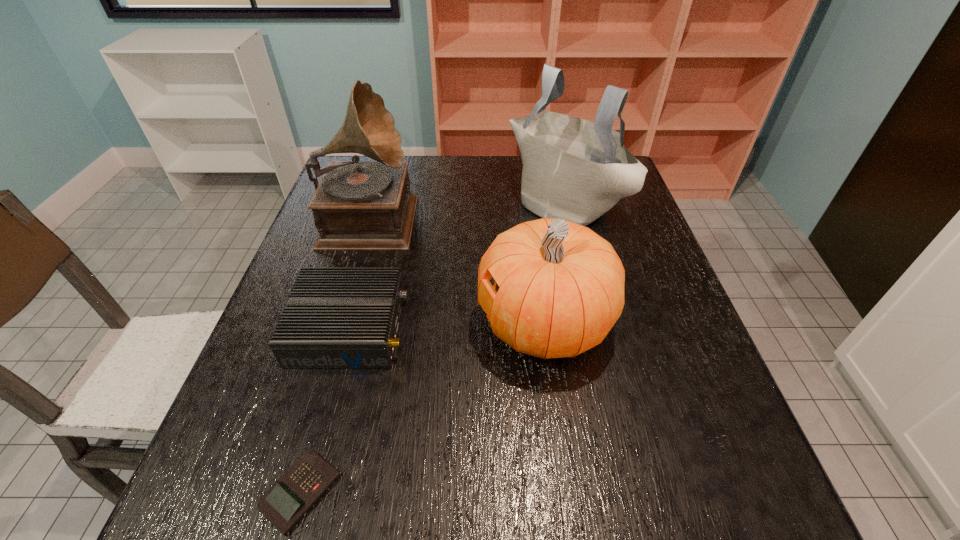
Locate an element on the screen. The width and height of the screenshot is (960, 540). free spot between the third tallest object and the router is located at coordinates click(x=447, y=326).

Where is `free space between the shopping bag and the shortest object`? This screenshot has height=540, width=960. free space between the shopping bag and the shortest object is located at coordinates (432, 347).

You are a GUI agent. You are given a task and a screenshot of the screen. Output one action in this format:
    pyautogui.click(x=<x>, y=<y>)
    Task: Click on the vacant area between the calculator and the pumpkin
    Image resolution: width=960 pixels, height=540 pixels.
    Given the screenshot: What is the action you would take?
    click(422, 407)

Locate which object is the second closest to the pumpkin. Please provide its 2D coordinates. Your answer should be formatted as a tuple, i.e. [(x, y)], where the tuple contains the x and y coordinates of a point satisfying the conditions above.

[(573, 169)]

You are a GUI agent. You are given a task and a screenshot of the screen. Output one action in this format:
    pyautogui.click(x=<x>, y=<y>)
    Task: Click on the closest object to the shopping bag
    The width and height of the screenshot is (960, 540).
    Given the screenshot: What is the action you would take?
    pyautogui.click(x=559, y=287)

This screenshot has height=540, width=960. I want to click on free location that satisfies the following two spatial constraints: 1. from the horn of the nearest object; 2. on the right side of the record player, so click(287, 491).